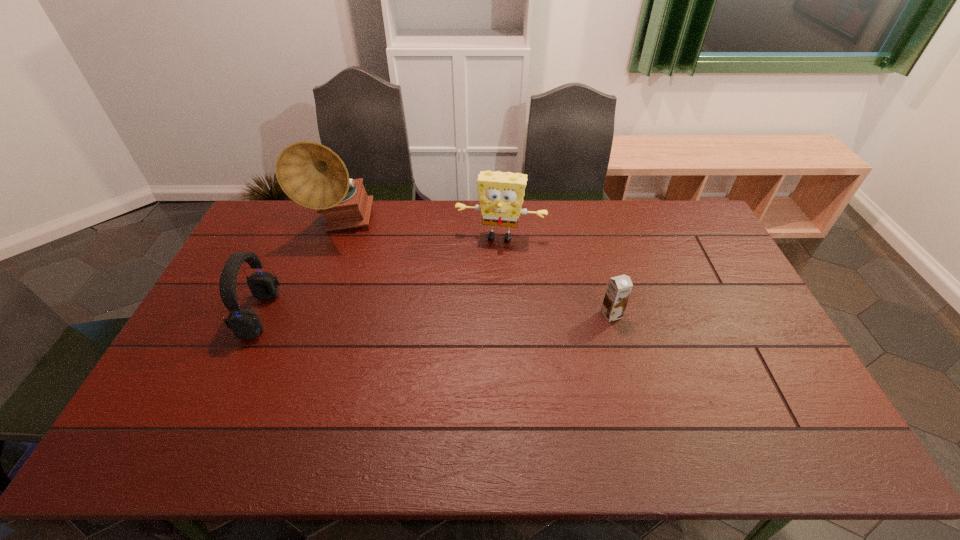
You are a GUI agent. You are given a task and a screenshot of the screen. Output one action in this format:
    pyautogui.click(x=<x>, y=<y>)
    Task: Click on the free space between the phonograph record and the second object from right to left
    
    Given the screenshot: What is the action you would take?
    pyautogui.click(x=420, y=231)

The width and height of the screenshot is (960, 540). Find the location of `free space between the tallest object and the second object from right to left`. free space between the tallest object and the second object from right to left is located at coordinates (420, 231).

This screenshot has width=960, height=540. In order to click on object that is the third closest to the headset in this screenshot , I will do `click(619, 288)`.

This screenshot has width=960, height=540. I want to click on object that stands as the third closest to the sponge, so click(245, 324).

Find the location of a particular element. free space that satisfies the following two spatial constraints: 1. on the front side of the rightmost object; 2. on the right side of the phonograph record is located at coordinates (308, 314).